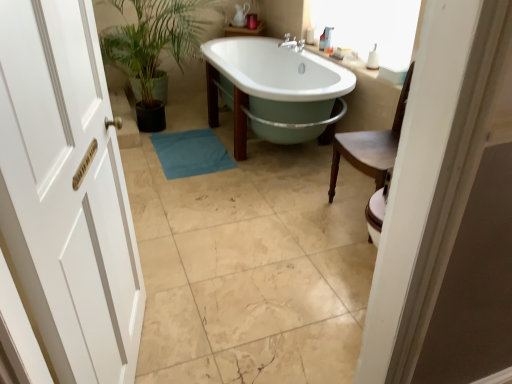
Question: Does white wooden door at left have a greater width compared to white glossy sink at upper right?

Choices:
 (A) yes
 (B) no

Answer: (A)

Question: From a real-world perspective, is white wooden door at left below white glossy sink at upper right?

Choices:
 (A) yes
 (B) no

Answer: (B)

Question: From the image's perspective, would you say white wooden door at left is positioned over white glossy sink at upper right?

Choices:
 (A) no
 (B) yes

Answer: (A)

Question: Does white wooden door at left have a larger size compared to white glossy sink at upper right?

Choices:
 (A) yes
 (B) no

Answer: (A)

Question: Is white wooden door at left behind white glossy sink at upper right?

Choices:
 (A) yes
 (B) no

Answer: (B)

Question: Is white glossy sink at upper right spatially inside white wooden door at left, or outside of it?

Choices:
 (A) inside
 (B) outside

Answer: (B)

Question: From a real-world perspective, is white glossy sink at upper right above or below white wooden door at left?

Choices:
 (A) below
 (B) above

Answer: (A)

Question: Is white glossy sink at upper right bigger or smaller than white wooden door at left?

Choices:
 (A) big
 (B) small

Answer: (B)

Question: Is white glossy sink at upper right taller or shorter than white wooden door at left?

Choices:
 (A) short
 (B) tall

Answer: (A)

Question: From a real-world perspective, is teal fabric bath mat at center positioned above or below white wooden door at left?

Choices:
 (A) below
 (B) above

Answer: (A)

Question: From the image's perspective, is teal fabric bath mat at center positioned above or below white wooden door at left?

Choices:
 (A) below
 (B) above

Answer: (B)

Question: In terms of width, does teal fabric bath mat at center look wider or thinner when compared to white wooden door at left?

Choices:
 (A) wide
 (B) thin

Answer: (A)

Question: Relative to white wooden door at left, is teal fabric bath mat at center in front or behind?

Choices:
 (A) front
 (B) behind

Answer: (B)

Question: From a real-world perspective, relative to white wooden door at left, is pastel green enamel bathtub at center vertically above or below?

Choices:
 (A) above
 (B) below

Answer: (B)

Question: Looking at their shapes, would you say pastel green enamel bathtub at center is wider or thinner than white wooden door at left?

Choices:
 (A) wide
 (B) thin

Answer: (A)